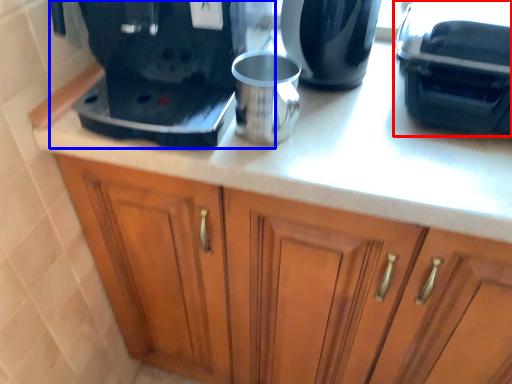
Question: Among these objects, which one is farthest to the camera, coffee machine (highlighted by a red box) or home appliance (highlighted by a blue box)?

Choices:
 (A) coffee machine
 (B) home appliance

Answer: (A)